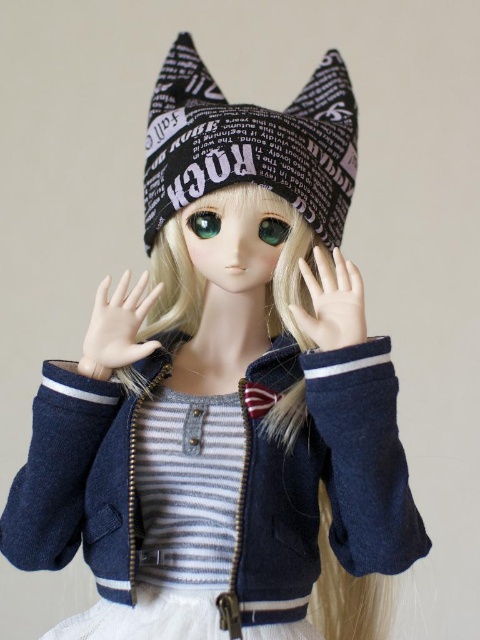
Is smooth skin hand at center wider than smooth porcelain hand at center?

Correct, the width of smooth skin hand at center exceeds that of smooth porcelain hand at center.

Does smooth skin hand at center appear under smooth porcelain hand at center?

Yes.

Locate an element on the screen. The width and height of the screenshot is (480, 640). smooth skin hand at center is located at coordinates (117, 326).

Is black printed fabric hat at center closer to the viewer compared to smooth skin hand at center?

No.

Does black printed fabric hat at center appear on the left side of smooth skin hand at center?

In fact, black printed fabric hat at center is to the right of smooth skin hand at center.

Measure the distance between black printed fabric hat at center and camera.

31.65 inches

In order to click on black printed fabric hat at center in this screenshot , I will do `click(250, 144)`.

Can you confirm if black printed fabric hat at center is positioned below green glossy eye at center?

Incorrect, black printed fabric hat at center is not positioned below green glossy eye at center.

You are a GUI agent. You are given a task and a screenshot of the screen. Output one action in this format:
    pyautogui.click(x=<x>, y=<y>)
    Task: Click on the black printed fabric hat at center
    Image resolution: width=480 pixels, height=640 pixels.
    Given the screenshot: What is the action you would take?
    pyautogui.click(x=250, y=144)